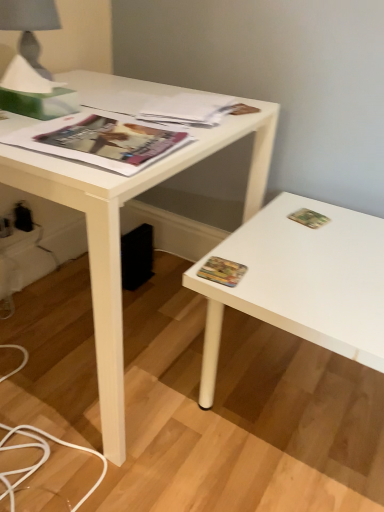
Question: Is matte paper magazine at upper left, positioned as the first magazine in front-to-back order, located outside multicolored paper at right, arranged as the first paperback book when ordered from the bottom?

Choices:
 (A) no
 (B) yes

Answer: (B)

Question: Is matte paper magazine at upper left, which is counted as the second magazine, starting from the back, taller than multicolored paper at right, which appears as the second paperback book when viewed from the right?

Choices:
 (A) yes
 (B) no

Answer: (A)

Question: Is there a large distance between matte paper magazine at upper left, which is counted as the second magazine, starting from the back, and multicolored paper at right, arranged as the first paperback book when ordered from the bottom?

Choices:
 (A) no
 (B) yes

Answer: (A)

Question: Does matte paper magazine at upper left, positioned as the first magazine in front-to-back order, have a lesser width compared to multicolored paper at right, arranged as the first paperback book when viewed from the front?

Choices:
 (A) no
 (B) yes

Answer: (A)

Question: From a real-world perspective, is matte paper magazine at upper left, which is counted as the second magazine, starting from the back, on multicolored paper at right, arranged as the first paperback book when viewed from the front?

Choices:
 (A) yes
 (B) no

Answer: (A)

Question: Looking at the image, does multicolored paper at right, the 1th paperback book when ordered from left to right, seem bigger or smaller compared to matte paper magazine at upper left, positioned as the first magazine in front-to-back order?

Choices:
 (A) big
 (B) small

Answer: (B)

Question: Considering the relative positions of multicolored paper at right, which appears as the 2th paperback book when viewed from the back, and matte paper magazine at upper left, which is counted as the second magazine, starting from the back, in the image provided, is multicolored paper at right, which appears as the 2th paperback book when viewed from the back, to the left or to the right of matte paper magazine at upper left, which is counted as the second magazine, starting from the back,?

Choices:
 (A) right
 (B) left

Answer: (A)

Question: Is multicolored paper at right, arranged as the first paperback book when viewed from the front, situated inside matte paper magazine at upper left, positioned as the first magazine in front-to-back order, or outside?

Choices:
 (A) inside
 (B) outside

Answer: (B)

Question: From the image's perspective, relative to matte paper magazine at upper left, which is counted as the second magazine, starting from the back, is multicolored paper at right, the 1th paperback book when ordered from left to right, above or below?

Choices:
 (A) above
 (B) below

Answer: (B)

Question: Considering their positions, is black plastic electric outlet at lower left, which ranks as the 1th electric outlet in back-to-front order, located in front of or behind green matte paperback book at upper right, placed as the first paperback book when sorted from back to front?

Choices:
 (A) behind
 (B) front

Answer: (A)

Question: Considering the relative positions of black plastic electric outlet at lower left, the 2th electric outlet viewed from the front, and green matte paperback book at upper right, which ranks as the 2th paperback book in front-to-back order, in the image provided, is black plastic electric outlet at lower left, the 2th electric outlet viewed from the front, to the left or to the right of green matte paperback book at upper right, which ranks as the 2th paperback book in front-to-back order,?

Choices:
 (A) right
 (B) left

Answer: (B)

Question: Based on their sizes in the image, would you say black plastic electric outlet at lower left, the 2th electric outlet viewed from the front, is bigger or smaller than green matte paperback book at upper right, which is counted as the second paperback book, starting from the bottom?

Choices:
 (A) small
 (B) big

Answer: (B)

Question: Would you say black plastic electric outlet at lower left, the 2th electric outlet viewed from the front, is inside or outside green matte paperback book at upper right, which ranks as the 2th paperback book in front-to-back order?

Choices:
 (A) inside
 (B) outside

Answer: (B)

Question: Is point (228, 273) closer or farther from the camera than point (155, 108)?

Choices:
 (A) farther
 (B) closer

Answer: (B)

Question: Considering the positions of multicolored paper at right, which appears as the second paperback book when viewed from the right, and matte paper magazine at upper center, the second magazine from the front, in the image, is multicolored paper at right, which appears as the second paperback book when viewed from the right, wider or thinner than matte paper magazine at upper center, the second magazine from the front,?

Choices:
 (A) wide
 (B) thin

Answer: (B)